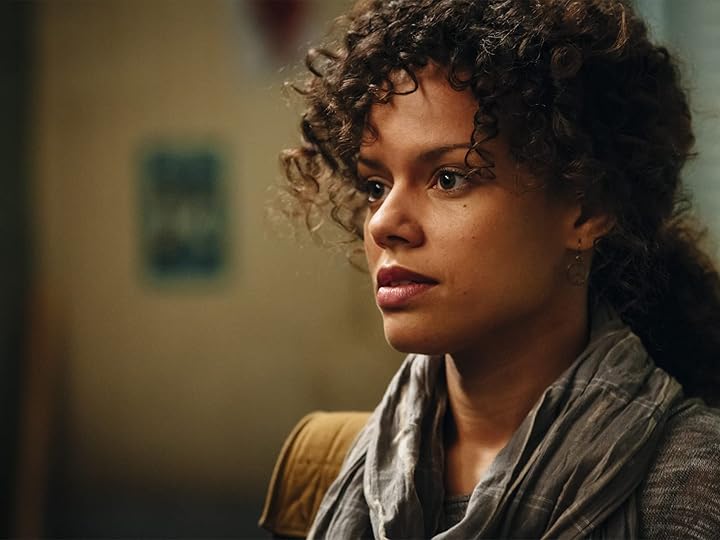
I want to click on chair, so click(x=318, y=447).